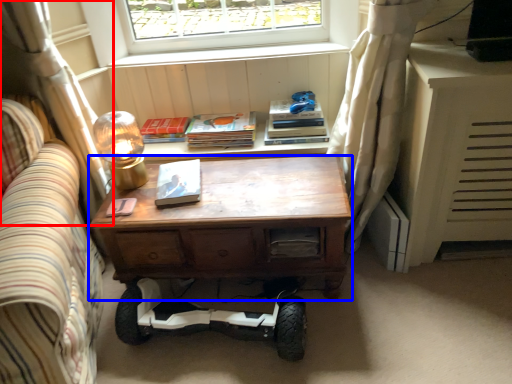
Question: Which point is further to the camera, curtain (highlighted by a red box) or desk (highlighted by a blue box)?

Choices:
 (A) curtain
 (B) desk

Answer: (B)